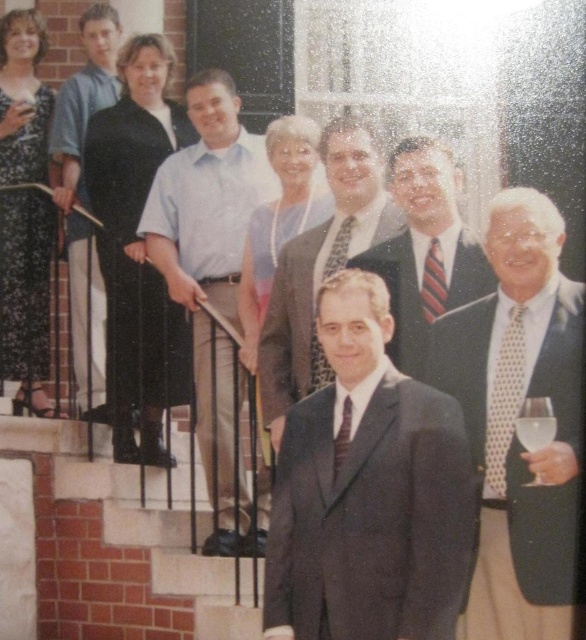
You are a photographer trying to adjust the focus of your camera. You need to ensure that both the black floral dress at left and the light blue shirt at upper left are in focus. Given that the depth of field can cover objects within a 7 feet range, will both items be in focus?

The black floral dress at left is 7.47 feet away from the light blue shirt at upper left. Since the depth of field can cover up to 7 feet, the distance between them exceeds this range, so both items cannot be in focus simultaneously.

You are standing at the position of point (x=547, y=417) and want to move forward to the front of the group. Is the path blocked by point (x=515, y=440)?

Point (x=515, y=440) is behind point (x=547, y=417), so the path is not blocked by point (x=515, y=440). You can move forward without obstruction.

You are a photographer trying to adjust the lighting for a group photo. You notice two central figures in the scene, the shiny dark suit at center and the matte blue dress at center. Which of these two has a wider silhouette when viewed from the front?

The shiny dark suit at center has a larger width than the matte blue dress at center, so the shiny dark suit at center has a wider silhouette when viewed from the front.